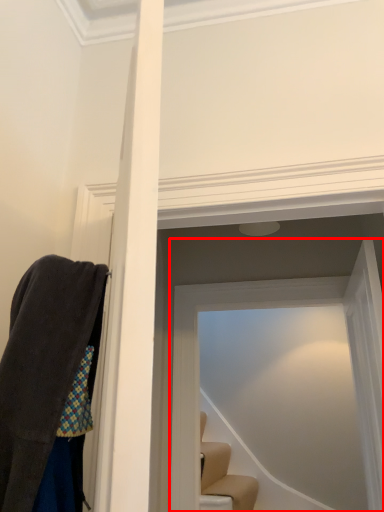
Question: From the image, what is the correct spatial relationship of glass door (annotated by the red box) in relation to glass door?

Choices:
 (A) left
 (B) right

Answer: (A)